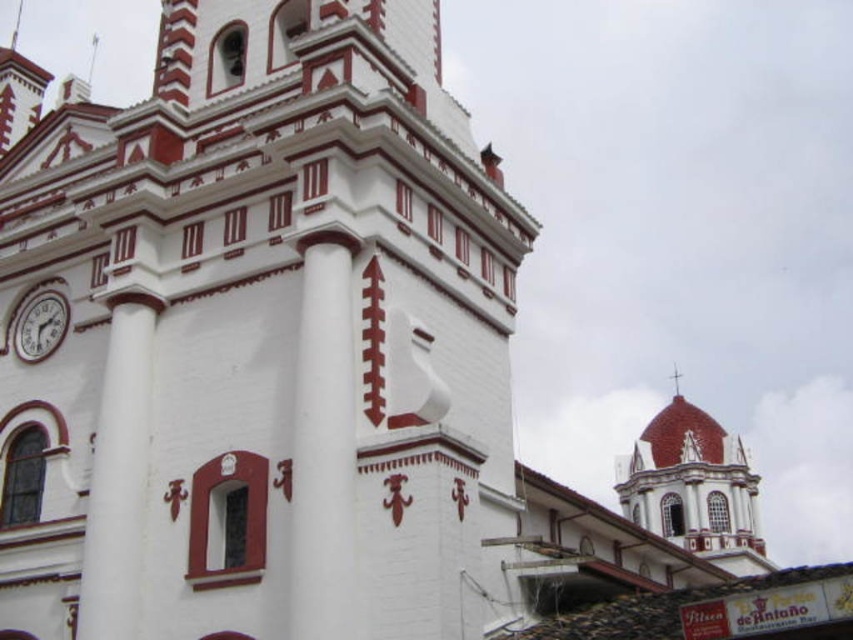
Question: Is smooth red dome at upper right wider than white glossy clock at upper left?

Choices:
 (A) no
 (B) yes

Answer: (B)

Question: Which object appears closest to the camera in this image?

Choices:
 (A) smooth red dome at upper right
 (B) white marble column at center

Answer: (B)

Question: Which point is closer to the camera?

Choices:
 (A) (38, 307)
 (B) (119, 330)

Answer: (B)

Question: In this image, where is white marble column at center located relative to smooth red dome at upper right?

Choices:
 (A) right
 (B) left

Answer: (B)

Question: Which of the following is the closest to the observer?

Choices:
 (A) (45, 355)
 (B) (105, 518)

Answer: (B)

Question: Can you confirm if white marble column at center is positioned below white smooth column at left?

Choices:
 (A) yes
 (B) no

Answer: (B)